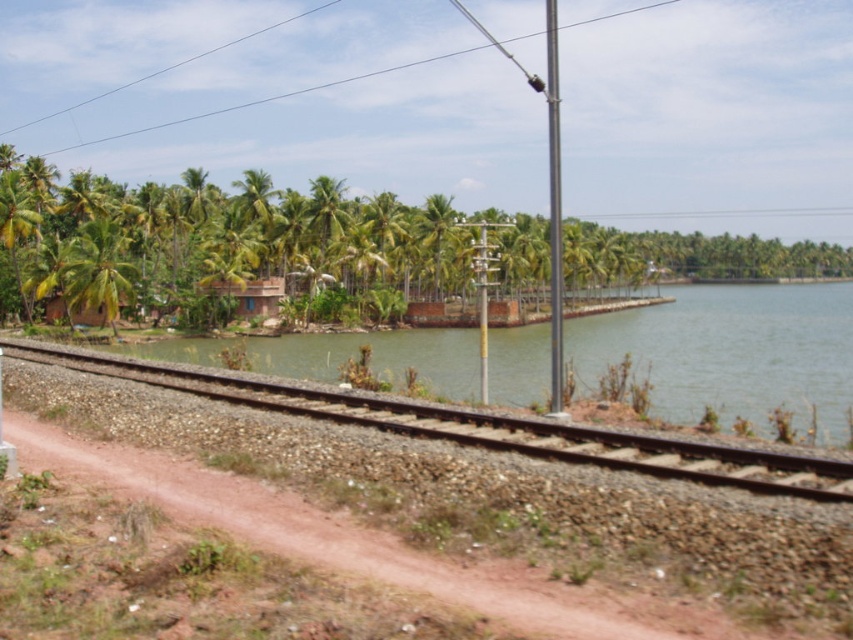
You are a railway worker checking the distance between two poles for safety regulations. The safety regulation states that poles must be at least 60 meters apart. You observe the silver metallic pole at right and the metallic pole at center in the scene. Are they compliant with the regulation?

The silver metallic pole at right and metallic pole at center are 66.88 meters apart, which exceeds the minimum requirement of 60 meters. Therefore, they are compliant with the safety regulation.

You are standing at the camera position and want to reach the point labeled as point (550, 301). Can you estimate how far you need to walk to get there?

The distance between you and the point (550, 301) is 25.94 meters, so you need to walk approximately 25.94 meters to reach it.